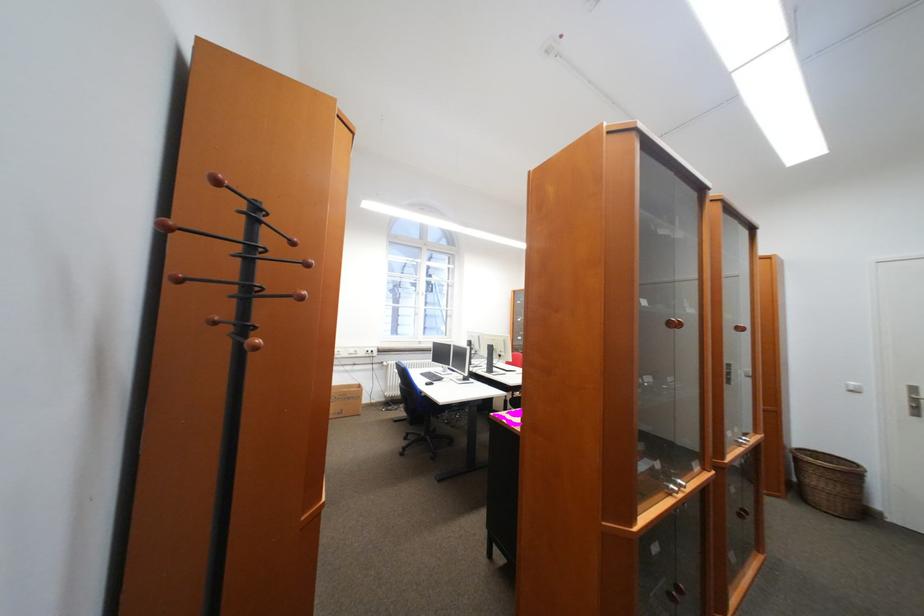
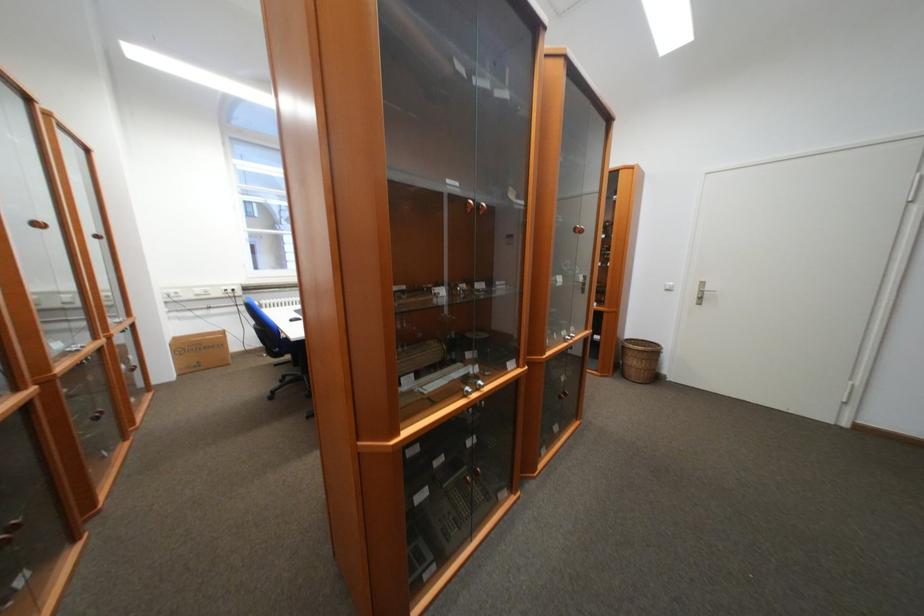
Question: The images are taken continuously from a first-person perspective. In which direction is your viewpoint rotating?

Choices:
 (A) Left
 (B) Right
 (C) Up
 (D) Down

Answer: (D)